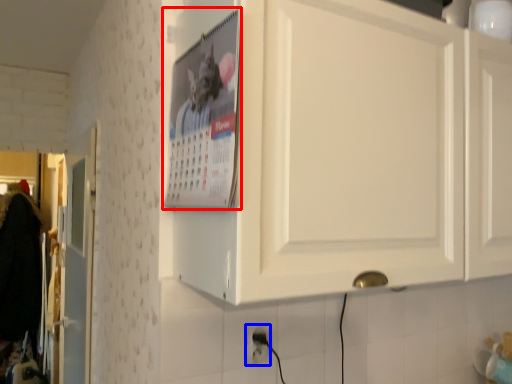
Question: Among these objects, which one is nearest to the camera, poster page (highlighted by a red box) or electric outlet (highlighted by a blue box)?

Choices:
 (A) poster page
 (B) electric outlet

Answer: (A)